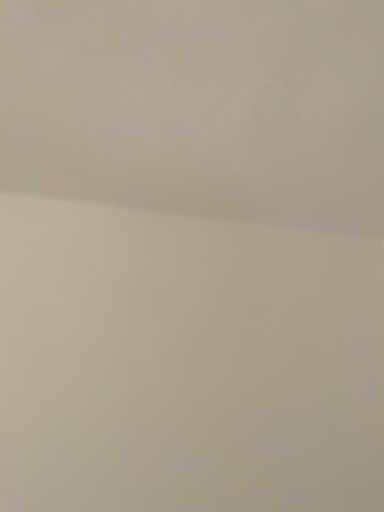
Question: Should I look upward or downward to see smooth matte wall at upper center?

Choices:
 (A) down
 (B) up

Answer: (B)